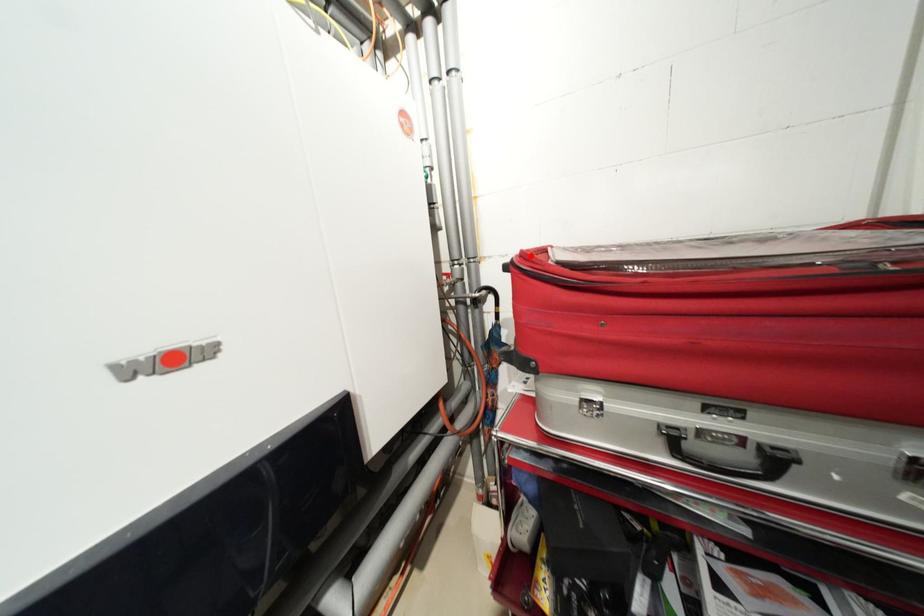
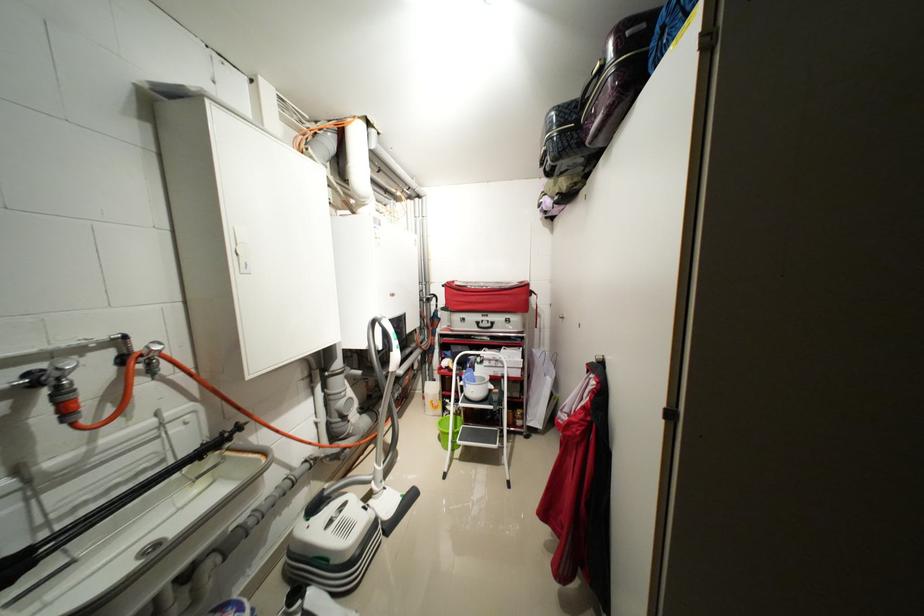
Question: I am providing you with two images of the same scene from different viewpoints. A red point is marked on the first image. Is the red point's position out of view in image 2?

Choices:
 (A) Yes
 (B) No

Answer: (B)